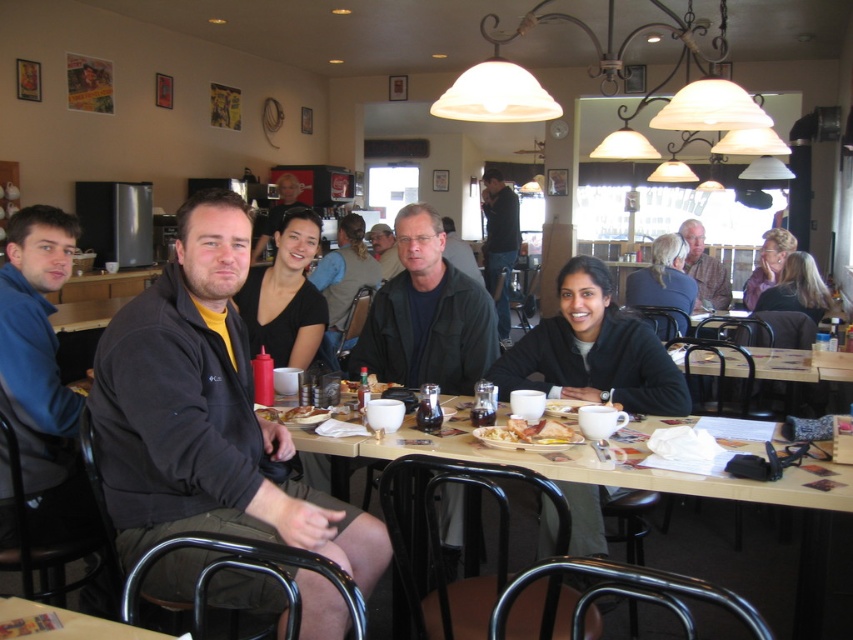
Question: Is light brown leather jacket at upper right thinner than matte black shirt at center?

Choices:
 (A) no
 (B) yes

Answer: (A)

Question: Which point is closer to the camera?

Choices:
 (A) (648, 289)
 (B) (306, 412)

Answer: (B)

Question: Where is golden crispy hash brown at center located in relation to matte plastic sandwich at center in the image?

Choices:
 (A) above
 (B) below

Answer: (B)

Question: Considering the real-world distances, which object is closest to the wooden table at center?

Choices:
 (A) matte black shirt at center
 (B) dark brown hair at center
 (C) matte plastic sandwich at center
 (D) matte black jacket at center

Answer: (C)

Question: Among these objects, which one is nearest to the camera?

Choices:
 (A) dark brown hair at center
 (B) light brown hair at upper right
 (C) light brown leather jacket at upper right

Answer: (A)

Question: Can you confirm if light brown hair at upper right is positioned above golden crispy hash brown at center?

Choices:
 (A) no
 (B) yes

Answer: (B)